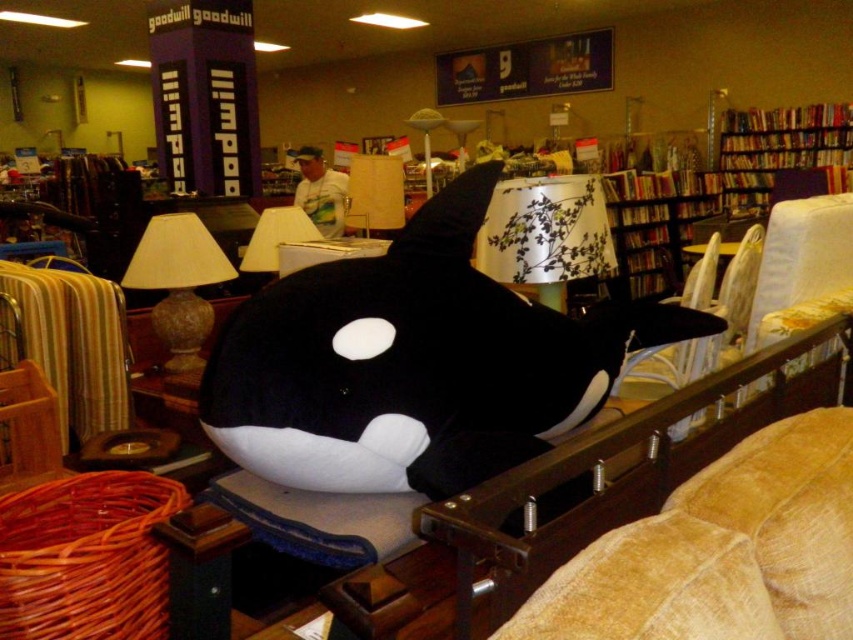
Is velvet tan couch at lower right bigger than white paper lampshade at center?

Indeed, velvet tan couch at lower right has a larger size compared to white paper lampshade at center.

Between velvet tan couch at lower right and white paper lampshade at center, which one appears on the right side from the viewer's perspective?

From the viewer's perspective, velvet tan couch at lower right appears more on the right side.

Who is more distant from viewer, (653, 534) or (252, 240)?

The point (252, 240) is behind.

This screenshot has width=853, height=640. Find the location of `velvet tan couch at lower right`. velvet tan couch at lower right is located at coordinates (721, 550).

Is black plush whale at center further to the viewer compared to matte brown lampshade at left?

No, it is in front of matte brown lampshade at left.

Is black plush whale at center wider than matte brown lampshade at left?

Correct, the width of black plush whale at center exceeds that of matte brown lampshade at left.

Measure the distance between black plush whale at center and camera.

The distance of black plush whale at center from camera is 3.90 feet.

Where is `black plush whale at center`? The image size is (853, 640). black plush whale at center is located at coordinates [x=415, y=364].

Does velvet tan couch at lower right appear over matte brown lampshade at left?

Incorrect, velvet tan couch at lower right is not positioned above matte brown lampshade at left.

Where is `velvet tan couch at lower right`? velvet tan couch at lower right is located at coordinates (721, 550).

I want to click on velvet tan couch at lower right, so click(721, 550).